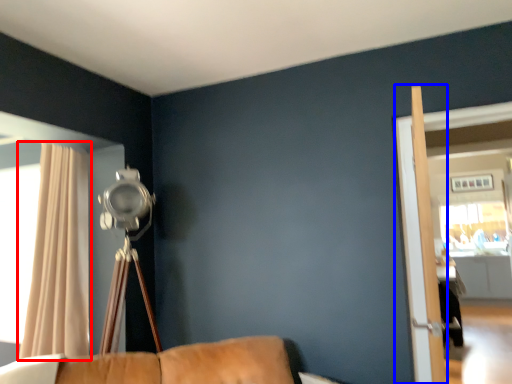
Question: Which object appears closest to the camera in this image, curtain (highlighted by a red box) or screen door (highlighted by a blue box)?

Choices:
 (A) curtain
 (B) screen door

Answer: (B)